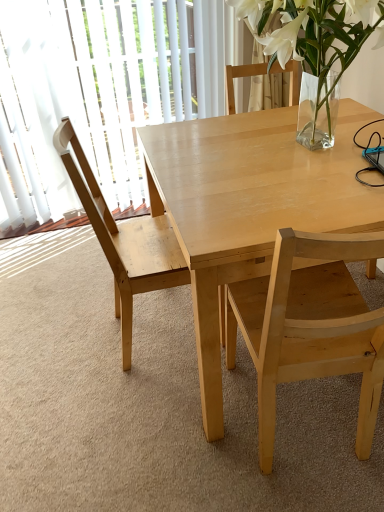
The image size is (384, 512). What do you see at coordinates (124, 240) in the screenshot?
I see `light wood chair at left, which is the first chair from left to right` at bounding box center [124, 240].

Measure the distance between light wood chair at center, which ranks as the 2th chair in left-to-right order, and camera.

A distance of 73.26 centimeters exists between light wood chair at center, which ranks as the 2th chair in left-to-right order, and camera.

What do you see at coordinates (309, 326) in the screenshot? Image resolution: width=384 pixels, height=512 pixels. I see `light wood chair at center, placed as the first chair when sorted from right to left` at bounding box center [309, 326].

What is the approximate height of transparent glass door at left?

The height of transparent glass door at left is 3.79 feet.

Where is `light wood chair at left, which is the first chair from left to right`? The image size is (384, 512). light wood chair at left, which is the first chair from left to right is located at coordinates 124,240.

Is light wood chair at left, which is counted as the 2th chair, starting from the right, positioned with its back to transparent glass door at left?

light wood chair at left, which is counted as the 2th chair, starting from the right, does not have its back to transparent glass door at left.

Considering the relative sizes of light wood chair at left, which is counted as the 2th chair, starting from the right, and transparent glass door at left in the image provided, is light wood chair at left, which is counted as the 2th chair, starting from the right, bigger than transparent glass door at left?

Yes, light wood chair at left, which is counted as the 2th chair, starting from the right, is bigger than transparent glass door at left.

Looking at this image, is light wood chair at left, which is the first chair from left to right, at the right side of transparent glass door at left?

Yes, light wood chair at left, which is the first chair from left to right, is to the right of transparent glass door at left.

How different are the orientations of light wood chair at left, which is counted as the 2th chair, starting from the right, and transparent glass door at left in degrees?

light wood chair at left, which is counted as the 2th chair, starting from the right, and transparent glass door at left are facing 85.9 degrees away from each other.

In order to click on kitchen & dining room table lying above the light wood chair at center, which ranks as the 2th chair in left-to-right order (from the image's perspective) in this screenshot , I will do `click(249, 206)`.

From a real-world perspective, is light wood table at center located beneath light wood chair at center, placed as the first chair when sorted from right to left?

Correct, in the physical world, light wood table at center is lower than light wood chair at center, placed as the first chair when sorted from right to left.

Do you think light wood table at center is within light wood chair at center, placed as the first chair when sorted from right to left, or outside of it?

light wood table at center exists outside the volume of light wood chair at center, placed as the first chair when sorted from right to left.

Does light wood table at center have a smaller size compared to light wood chair at center, which ranks as the 2th chair in left-to-right order?

Incorrect, light wood table at center is not smaller in size than light wood chair at center, which ranks as the 2th chair in left-to-right order.

Who is smaller, light wood chair at center, which ranks as the 2th chair in left-to-right order, or transparent glass door at left?

light wood chair at center, which ranks as the 2th chair in left-to-right order, is smaller.

Is light wood chair at center, placed as the first chair when sorted from right to left, wider or thinner than transparent glass door at left?

light wood chair at center, placed as the first chair when sorted from right to left, is wider than transparent glass door at left.

Consider the image. Considering the relative positions of light wood chair at center, placed as the first chair when sorted from right to left, and transparent glass door at left in the image provided, is light wood chair at center, placed as the first chair when sorted from right to left, to the left of transparent glass door at left from the viewer's perspective?

No.

Is light wood chair at center, placed as the first chair when sorted from right to left, facing away from transparent glass door at left?

No, light wood chair at center, placed as the first chair when sorted from right to left,'s orientation is not away from transparent glass door at left.

Is light wood chair at left, which is the first chair from left to right, closer to camera compared to light wood chair at center, placed as the first chair when sorted from right to left?

No.

Considering the positions of point (128, 302) and point (273, 383), is point (128, 302) closer or farther from the camera than point (273, 383)?

Point (128, 302) is positioned farther from the camera compared to point (273, 383).

Identify the location of chair located in front of the light wood chair at left, which is the first chair from left to right. (309, 326).

Considering the relative sizes of light wood chair at left, which is counted as the 2th chair, starting from the right, and light wood chair at center, placed as the first chair when sorted from right to left, in the image provided, is light wood chair at left, which is counted as the 2th chair, starting from the right, taller than light wood chair at center, placed as the first chair when sorted from right to left,?

Correct, light wood chair at left, which is counted as the 2th chair, starting from the right, is much taller as light wood chair at center, placed as the first chair when sorted from right to left.

Is light wood chair at center, which ranks as the 2th chair in left-to-right order, oriented away from light wood chair at left, which is the first chair from left to right?

No, light wood chair at center, which ranks as the 2th chair in left-to-right order, is not facing away from light wood chair at left, which is the first chair from left to right.

Considering the relative positions of light wood chair at center, placed as the first chair when sorted from right to left, and light wood chair at left, which is counted as the 2th chair, starting from the right, in the image provided, is light wood chair at center, placed as the first chair when sorted from right to left, to the left of light wood chair at left, which is counted as the 2th chair, starting from the right, from the viewer's perspective?

No, light wood chair at center, placed as the first chair when sorted from right to left, is not to the left of light wood chair at left, which is counted as the 2th chair, starting from the right.

Is light wood chair at center, placed as the first chair when sorted from right to left, behind light wood chair at left, which is counted as the 2th chair, starting from the right?

No, it is in front of light wood chair at left, which is counted as the 2th chair, starting from the right.

Is light wood chair at center, placed as the first chair when sorted from right to left, far away from light wood chair at left, which is the first chair from left to right?

No, light wood chair at center, placed as the first chair when sorted from right to left, is in close proximity to light wood chair at left, which is the first chair from left to right.

Looking at their sizes, would you say transparent glass door at left is wider or thinner than light wood chair at left, which is the first chair from left to right?

Considering their sizes, transparent glass door at left looks slimmer than light wood chair at left, which is the first chair from left to right.

Is transparent glass door at left outside of light wood chair at left, which is counted as the 2th chair, starting from the right?

Indeed, transparent glass door at left is completely outside light wood chair at left, which is counted as the 2th chair, starting from the right.

Considering the relative positions of transparent glass door at left and light wood chair at left, which is the first chair from left to right, in the image provided, is transparent glass door at left to the right of light wood chair at left, which is the first chair from left to right, from the viewer's perspective?

Incorrect, transparent glass door at left is not on the right side of light wood chair at left, which is the first chair from left to right.

Is transparent glass door at left oriented away from light wood chair at left, which is the first chair from left to right?

Yes.

How much distance is there between light wood table at center and light wood chair at left, which is the first chair from left to right?

The distance of light wood table at center from light wood chair at left, which is the first chair from left to right, is 14.60 inches.

Is light wood table at center facing towards light wood chair at left, which is counted as the 2th chair, starting from the right?

Yes, light wood table at center is aimed at light wood chair at left, which is counted as the 2th chair, starting from the right.

Are light wood table at center and light wood chair at left, which is counted as the 2th chair, starting from the right, located far from each other?

No, there isn't a large distance between light wood table at center and light wood chair at left, which is counted as the 2th chair, starting from the right.

From their relative heights in the image, would you say light wood table at center is taller or shorter than light wood chair at left, which is counted as the 2th chair, starting from the right?

Considering their sizes, light wood table at center has less height than light wood chair at left, which is counted as the 2th chair, starting from the right.

There is a transparent glass door at left. Where is `the 1st chair below it (from a real-world perspective)`? The width and height of the screenshot is (384, 512). the 1st chair below it (from a real-world perspective) is located at coordinates (124, 240).

Find the location of a particular element. chair in front of the light wood table at center is located at coordinates (309, 326).

Estimate the real-world distances between objects in this image. Which object is further from light wood chair at center, placed as the first chair when sorted from right to left, light wood table at center or light wood chair at left, which is counted as the 2th chair, starting from the right?

The object further to light wood chair at center, placed as the first chair when sorted from right to left, is light wood chair at left, which is counted as the 2th chair, starting from the right.

When comparing their distances from light wood table at center, does transparent glass door at left or light wood chair at left, which is counted as the 2th chair, starting from the right, seem further?

transparent glass door at left is positioned further to the anchor light wood table at center.

From the image, which object appears to be nearer to clear glass vase at upper right, light wood chair at center, which ranks as the 2th chair in left-to-right order, or transparent glass door at left?

light wood chair at center, which ranks as the 2th chair in left-to-right order, lies closer to clear glass vase at upper right than the other object.

Looking at this image, estimate the real-world distances between objects in this image. Which object is closer to light wood table at center, transparent glass door at left or clear glass vase at upper right?

clear glass vase at upper right is positioned closer to the anchor light wood table at center.

Looking at the image, which one is located further to transparent glass door at left, light wood chair at center, which ranks as the 2th chair in left-to-right order, or light wood chair at left, which is counted as the 2th chair, starting from the right?

Among the two, light wood chair at center, which ranks as the 2th chair in left-to-right order, is located further to transparent glass door at left.

Looking at the image, which one is located further to transparent glass door at left, light wood chair at center, which ranks as the 2th chair in left-to-right order, or clear glass vase at upper right?

The object further to transparent glass door at left is light wood chair at center, which ranks as the 2th chair in left-to-right order.

From the picture: Which object lies further to the anchor point light wood chair at left, which is the first chair from left to right, clear glass vase at upper right or light wood table at center?

clear glass vase at upper right is further to light wood chair at left, which is the first chair from left to right.

Considering their positions, is light wood table at center positioned further to light wood chair at left, which is counted as the 2th chair, starting from the right, than light wood chair at center, placed as the first chair when sorted from right to left?

The object further to light wood chair at left, which is counted as the 2th chair, starting from the right, is light wood chair at center, placed as the first chair when sorted from right to left.

Identify the location of kitchen & dining room table between clear glass vase at upper right and transparent glass door at left from front to back. The height and width of the screenshot is (512, 384). (249, 206).

At what (x,y) coordinates should I click in order to perform the action: click on chair between light wood chair at center, which ranks as the 2th chair in left-to-right order, and transparent glass door at left in the front-back direction. Please return your answer as a coordinate pair (x, y). This screenshot has width=384, height=512. Looking at the image, I should click on (124, 240).

Where is `chair between clear glass vase at upper right and light wood table at center in the vertical direction`? chair between clear glass vase at upper right and light wood table at center in the vertical direction is located at coordinates (124, 240).

I want to click on houseplant between light wood chair at center, which ranks as the 2th chair in left-to-right order, and transparent glass door at left from front to back, so click(x=313, y=35).